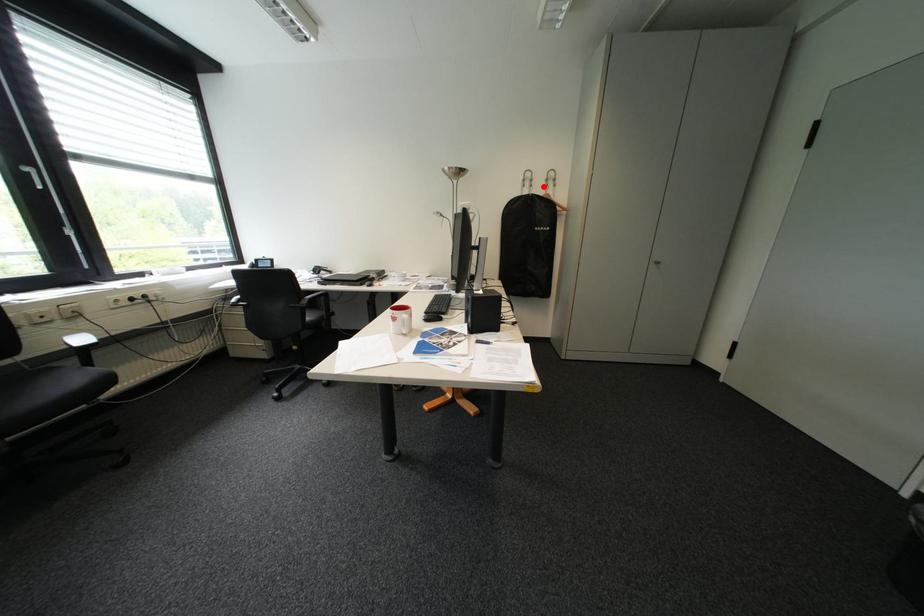
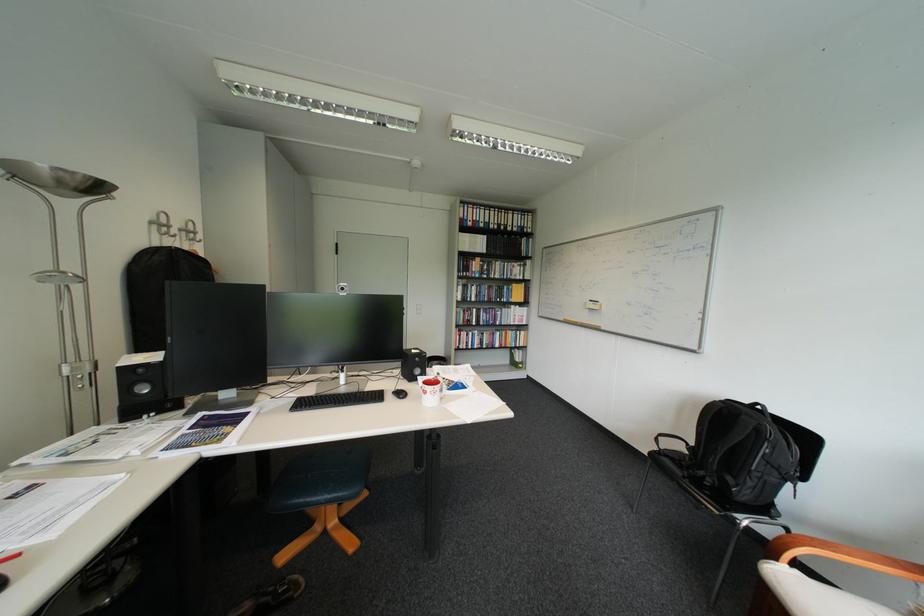
Where in the second image is the point corresponding to the highlighted location from the first image?

(187, 237)